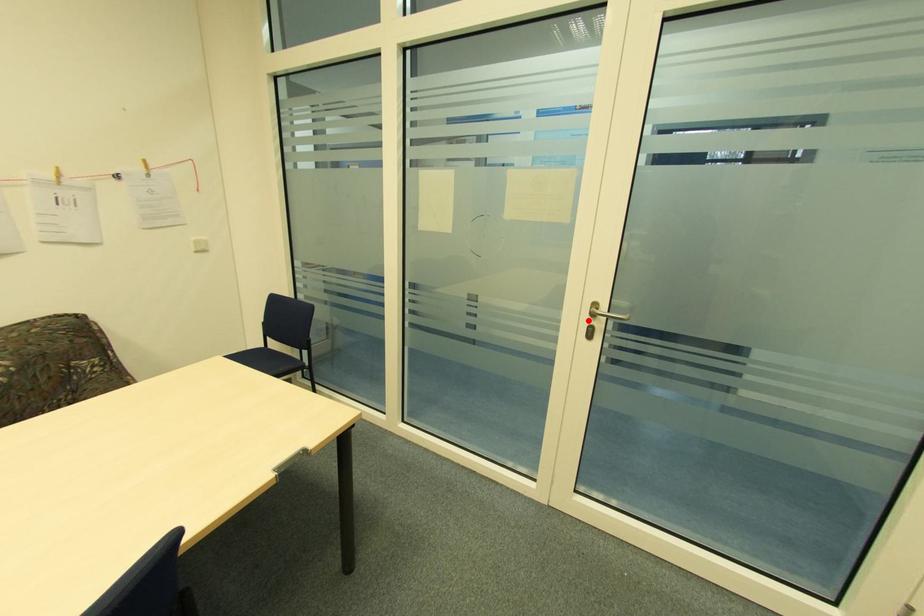
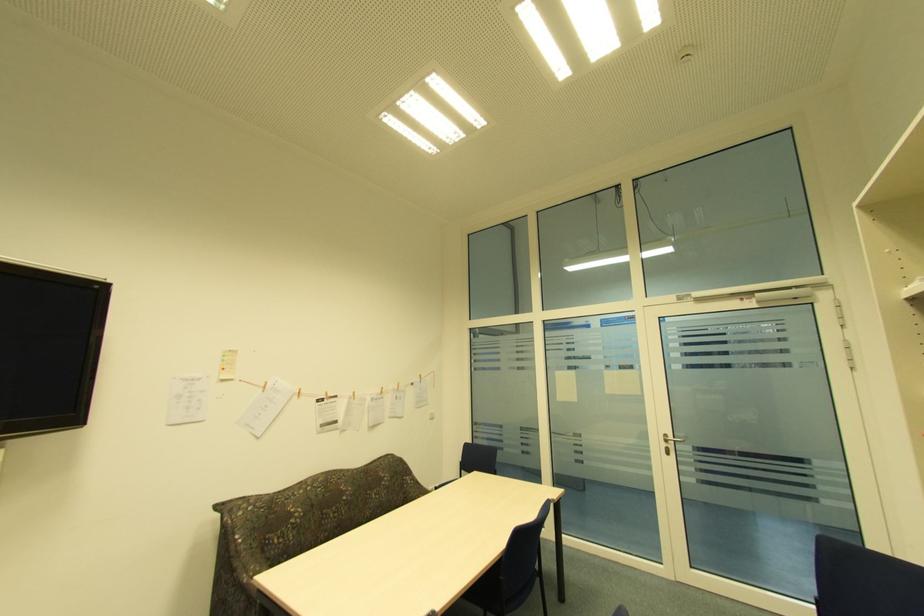
Locate, in the second image, the point that corresponds to the highlighted location in the first image.

(666, 445)